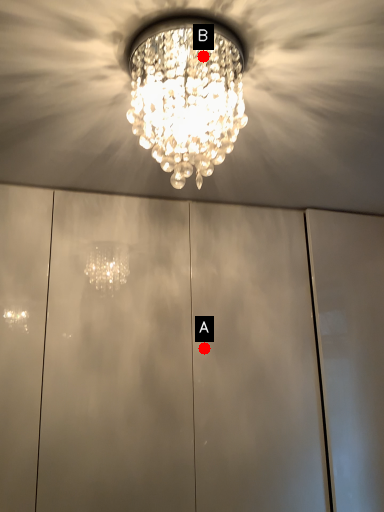
Question: Two points are circled on the image, labeled by A and B beside each circle. Which point appears closest to the camera in this image?

Choices:
 (A) A is closer
 (B) B is closer

Answer: (B)